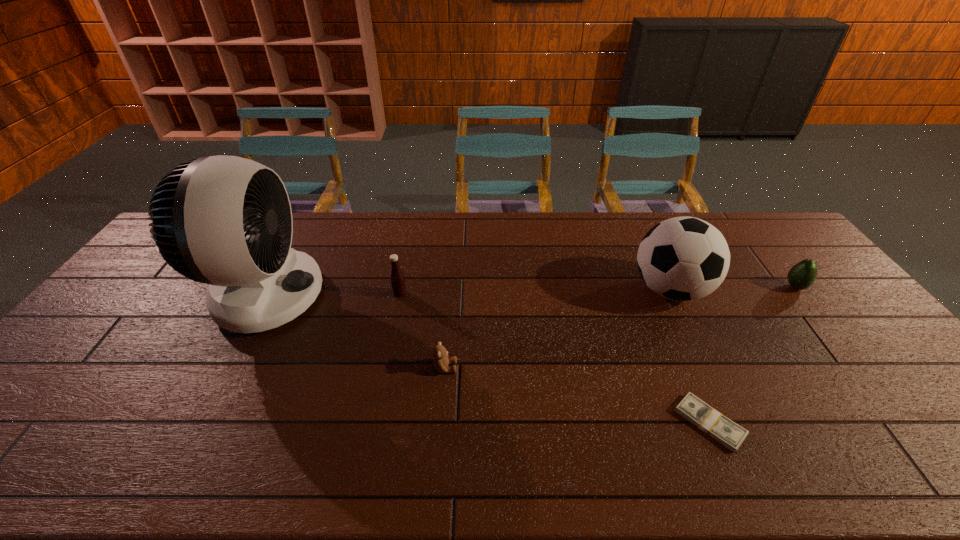
The height and width of the screenshot is (540, 960). What are the coordinates of `the leftmost object` in the screenshot? It's located at (226, 221).

Where is `the tallest object`? The width and height of the screenshot is (960, 540). the tallest object is located at coordinates (226, 221).

Identify the location of the second tallest object. The image size is (960, 540). (685, 258).

Image resolution: width=960 pixels, height=540 pixels. I want to click on the third tallest object, so click(x=397, y=280).

Find the location of a particular element. This screenshot has width=960, height=540. the second object from left to right is located at coordinates (397, 280).

Find the location of a particular element. The width and height of the screenshot is (960, 540). the rightmost object is located at coordinates (801, 276).

Locate an element on the screen. The image size is (960, 540). the fourth tallest object is located at coordinates (801, 276).

I want to click on the fourth object from right to left, so click(441, 361).

Identify the location of teddy bear. The height and width of the screenshot is (540, 960). (441, 361).

The width and height of the screenshot is (960, 540). I want to click on the nearest object, so click(728, 433).